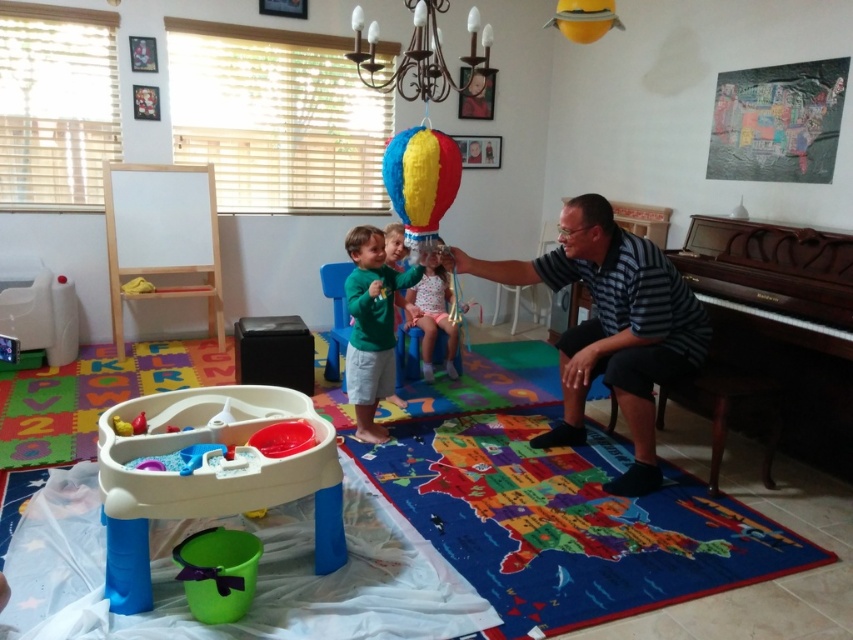
Which of these two, green matte shirt at center or matte pink dress at center, stands taller?

Standing taller between the two is green matte shirt at center.

Image resolution: width=853 pixels, height=640 pixels. Identify the location of green matte shirt at center. (370, 324).

Where is `green matte shirt at center`? This screenshot has height=640, width=853. green matte shirt at center is located at coordinates (370, 324).

Is white plastic water table at lower left wider than multicolored paper balloon at center?

Yes.

You are a GUI agent. You are given a task and a screenshot of the screen. Output one action in this format:
    pyautogui.click(x=<x>, y=<y>)
    Task: Click on the white plastic water table at lower left
    This screenshot has height=640, width=853.
    Given the screenshot: What is the action you would take?
    tap(213, 472)

Is striped shirt at center closer to camera compared to blue plastic chair at center?

Yes, striped shirt at center is in front of blue plastic chair at center.

Does striped shirt at center appear on the left side of blue plastic chair at center?

Incorrect, striped shirt at center is not on the left side of blue plastic chair at center.

You are a GUI agent. You are given a task and a screenshot of the screen. Output one action in this format:
    pyautogui.click(x=<x>, y=<y>)
    Task: Click on the striped shirt at center
    The height and width of the screenshot is (640, 853).
    Given the screenshot: What is the action you would take?
    pyautogui.click(x=611, y=324)

Locate an element on the screen. striped shirt at center is located at coordinates (611, 324).